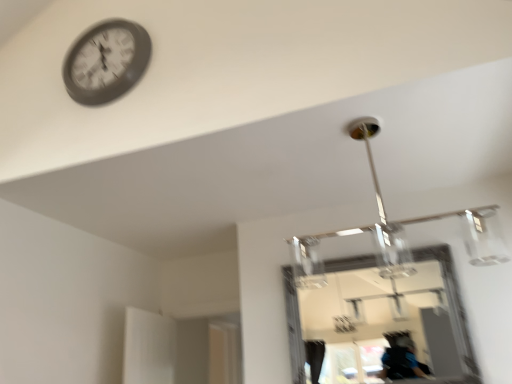
Question: From a real-world perspective, is matte black clock at upper left under clear glass mirror at center?

Choices:
 (A) no
 (B) yes

Answer: (A)

Question: Is matte black clock at upper left far from clear glass mirror at center?

Choices:
 (A) no
 (B) yes

Answer: (B)

Question: Considering the relative sizes of matte black clock at upper left and clear glass mirror at center in the image provided, is matte black clock at upper left shorter than clear glass mirror at center?

Choices:
 (A) yes
 (B) no

Answer: (A)

Question: Is matte black clock at upper left further to camera compared to clear glass mirror at center?

Choices:
 (A) yes
 (B) no

Answer: (B)

Question: From the image's perspective, does matte black clock at upper left appear lower than clear glass mirror at center?

Choices:
 (A) no
 (B) yes

Answer: (A)

Question: Can you confirm if matte black clock at upper left is wider than clear glass mirror at center?

Choices:
 (A) yes
 (B) no

Answer: (A)

Question: From a real-world perspective, is clear glass mirror at center below matte black clock at upper left?

Choices:
 (A) no
 (B) yes

Answer: (B)

Question: From the image's perspective, would you say clear glass mirror at center is shown under matte black clock at upper left?

Choices:
 (A) no
 (B) yes

Answer: (B)

Question: Is clear glass mirror at center next to matte black clock at upper left?

Choices:
 (A) no
 (B) yes

Answer: (A)

Question: Is the position of clear glass mirror at center more distant than that of matte black clock at upper left?

Choices:
 (A) yes
 (B) no

Answer: (A)

Question: Is clear glass mirror at center not near matte black clock at upper left?

Choices:
 (A) no
 (B) yes

Answer: (B)

Question: Can you confirm if clear glass mirror at center is smaller than matte black clock at upper left?

Choices:
 (A) yes
 (B) no

Answer: (B)

Question: In terms of size, does matte black clock at upper left appear bigger or smaller than clear glass mirror at center?

Choices:
 (A) small
 (B) big

Answer: (A)